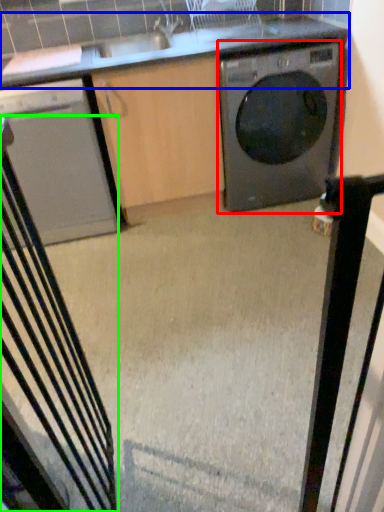
Question: Based on their relative distances, which object is farther from washing machine (highlighted by a red box)? Choose from countertop (highlighted by a blue box) and rocking chair (highlighted by a green box).

Choices:
 (A) countertop
 (B) rocking chair

Answer: (B)